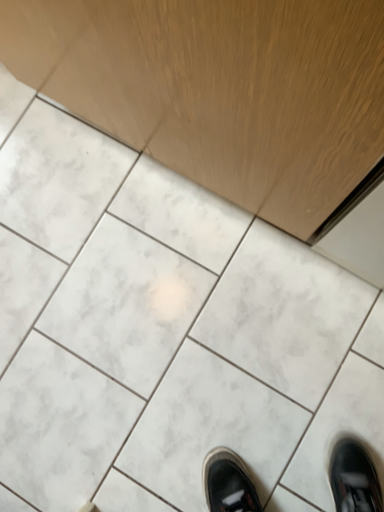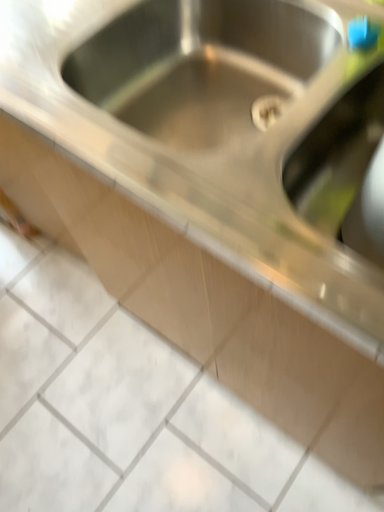
Question: How did the camera likely rotate when shooting the video?

Choices:
 (A) rotated upward
 (B) rotated downward

Answer: (A)